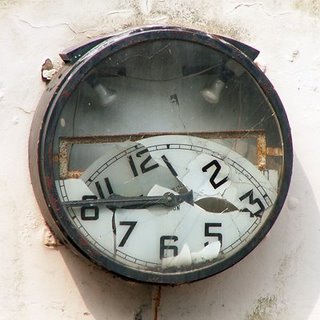
Identify the location of wall damage. (50, 72).